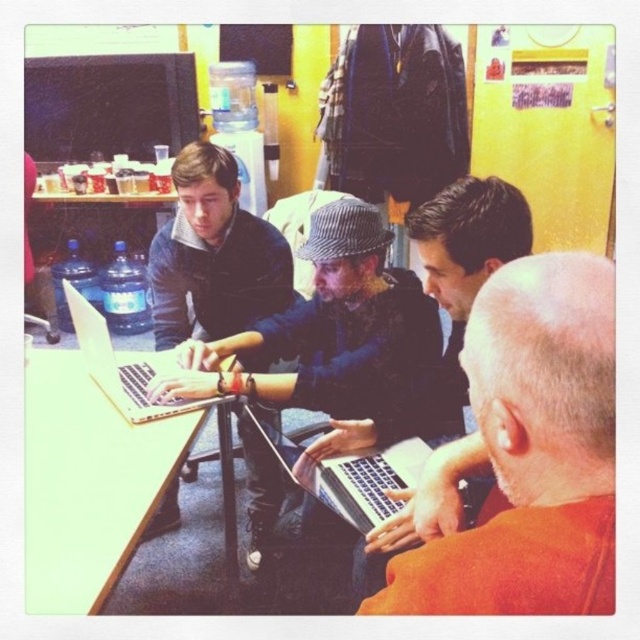
Question: Does wooden table at lower left appear on the right side of silver metallic laptop at center left?

Choices:
 (A) yes
 (B) no

Answer: (B)

Question: Does wooden table at lower left have a smaller size compared to silver metallic laptop at center left?

Choices:
 (A) no
 (B) yes

Answer: (A)

Question: Which point is closer to the camera?

Choices:
 (A) (257, 428)
 (B) (387, 438)

Answer: (B)

Question: Which object is farther from the camera taking this photo?

Choices:
 (A) silver metallic laptop at center left
 (B) silver metallic laptop at center

Answer: (A)

Question: Which point is closer to the camera taking this photo?

Choices:
 (A) (84, 513)
 (B) (205, 388)
 (C) (502, 465)

Answer: (C)

Question: Does matte black laptop at left appear on the right side of silver metallic laptop at center?

Choices:
 (A) yes
 (B) no

Answer: (B)